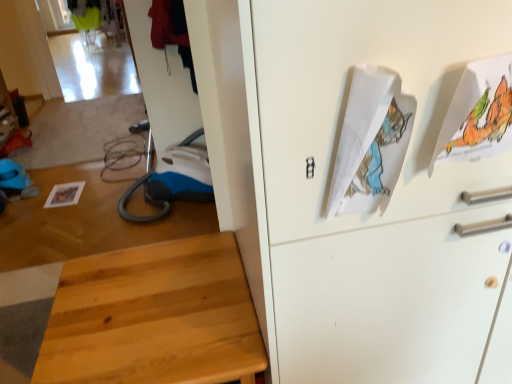
You are a GUI agent. You are given a task and a screenshot of the screen. Output one action in this format:
    pyautogui.click(x=<x>, y=<y>)
    Task: Click on the free point above light wood stool at lower left (from a real-world perspective)
    Image resolution: width=512 pixels, height=384 pixels.
    Given the screenshot: What is the action you would take?
    pyautogui.click(x=148, y=300)